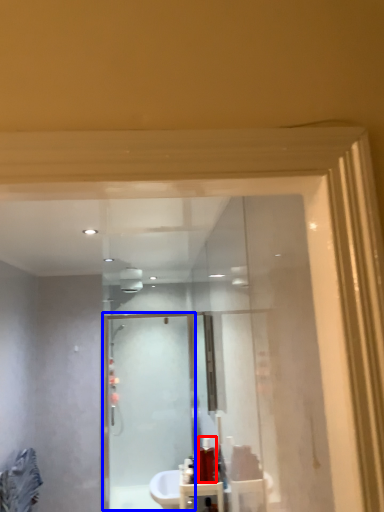
Question: Which of the following is the closest to the observer, toiletry (highlighted by a red box) or screen door (highlighted by a blue box)?

Choices:
 (A) toiletry
 (B) screen door

Answer: (A)